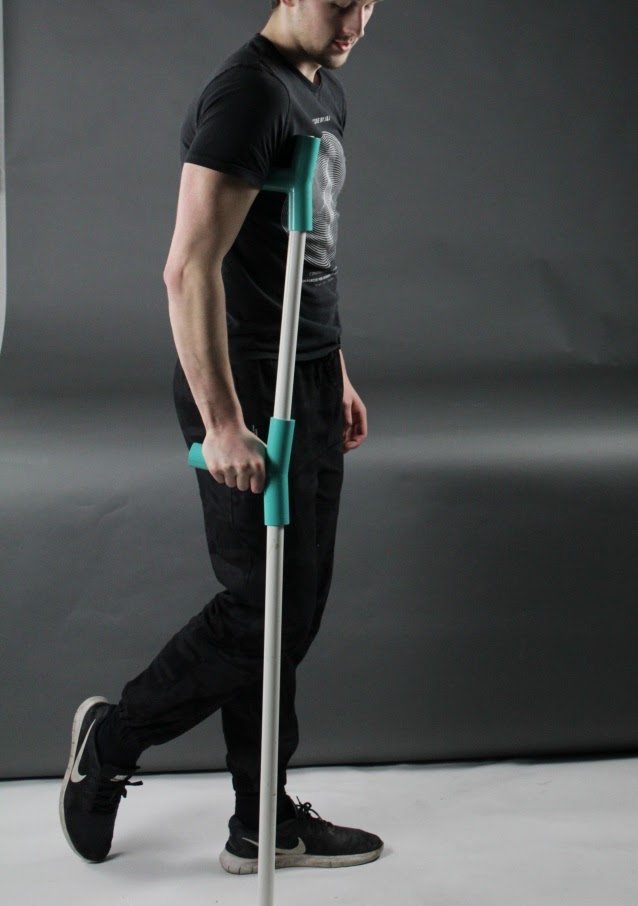
I want to click on floor, so click(457, 839).